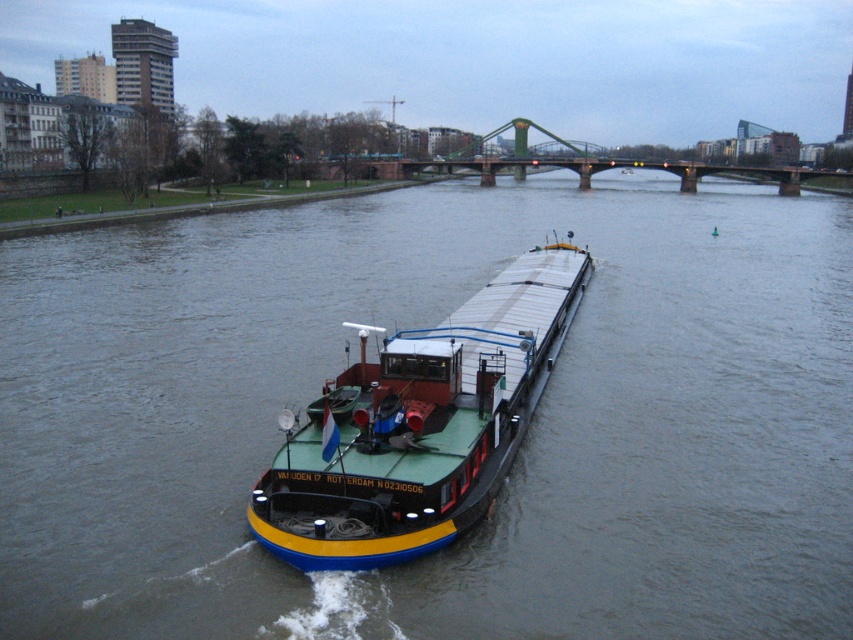
Which is behind, point (225, 227) or point (277, 460)?

The point (225, 227) is behind.

Can you confirm if smooth gray water at center is smaller than blue painted steel barge at center?

No, smooth gray water at center is not smaller than blue painted steel barge at center.

Describe the element at coordinates (518, 454) in the screenshot. This screenshot has height=640, width=853. I see `smooth gray water at center` at that location.

Find the location of a particular element. smooth gray water at center is located at coordinates pos(518,454).